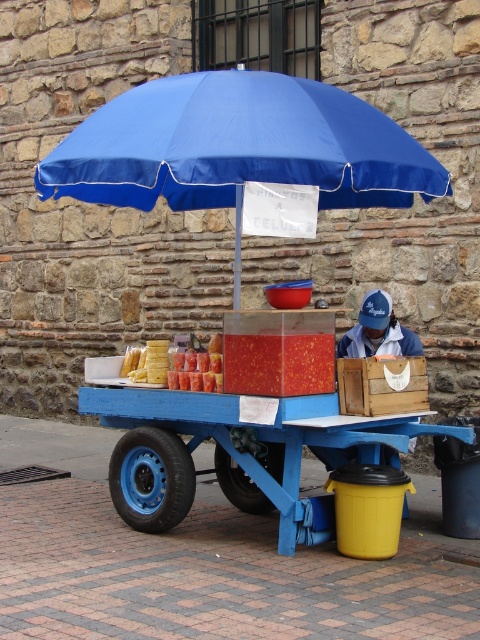
You are a customer standing in front of the blue wooden cart at center. You want to stay under the shade to avoid the sun. Can you stand under the blue fabric umbrella at upper center while still being near the cart?

The blue fabric umbrella at upper center is positioned over the blue wooden cart at center, so yes, you can stand under the blue fabric umbrella at upper center while staying near the cart to stay shaded.

You are a customer standing 5 feet away from the blue wooden cart at center. You want to grab the blue fabric umbrella at upper center. Can you reach it without moving closer?

The blue fabric umbrella at upper center is 6.63 feet away from the blue wooden cart at center. Since you are already 5 feet away from the blue wooden cart at center, the total distance to the umbrella is 5 feet plus 6.63 feet, totaling 11.63 feet. You cannot reach it without moving closer.

You are standing at the center of the street, looking towards the blue wooden cart at center. There is a point marked at coordinates (x=228, y=448). Where is this point located in relation to the blue wooden cart at center?

The point at (x=228, y=448) is located on the blue wooden cart at center.